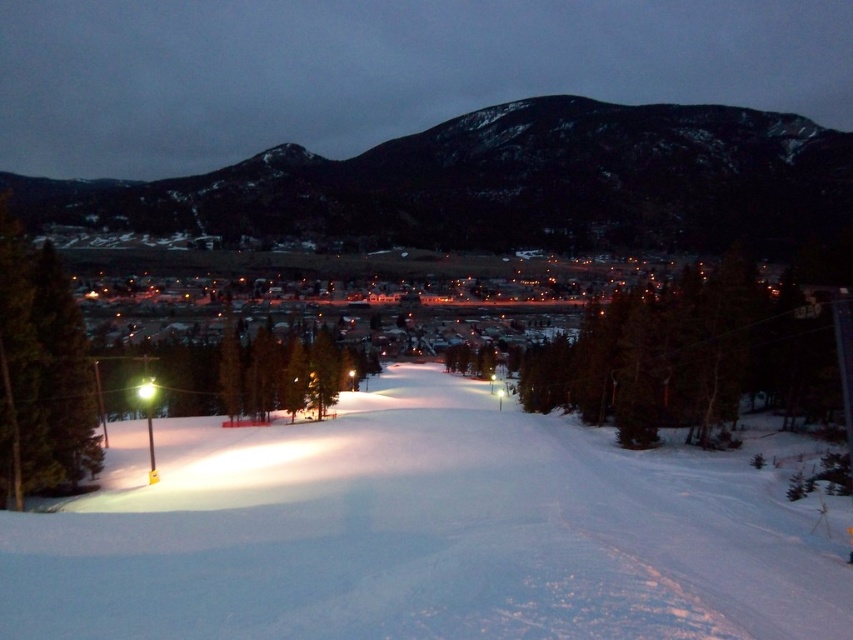
Question: Which point is farther to the camera?

Choices:
 (A) (677, 193)
 (B) (184, 506)

Answer: (A)

Question: Which of the following is the farthest from the observer?

Choices:
 (A) (254, 609)
 (B) (248, 189)

Answer: (B)

Question: Is white snow ski slope at center smaller than dark gray rocky hill at upper center?

Choices:
 (A) no
 (B) yes

Answer: (B)

Question: Does white snow ski slope at center appear under dark gray rocky hill at upper center?

Choices:
 (A) no
 (B) yes

Answer: (B)

Question: Can you confirm if white snow ski slope at center is positioned below dark gray rocky hill at upper center?

Choices:
 (A) no
 (B) yes

Answer: (B)